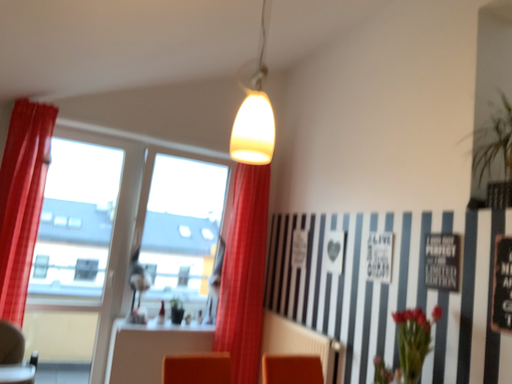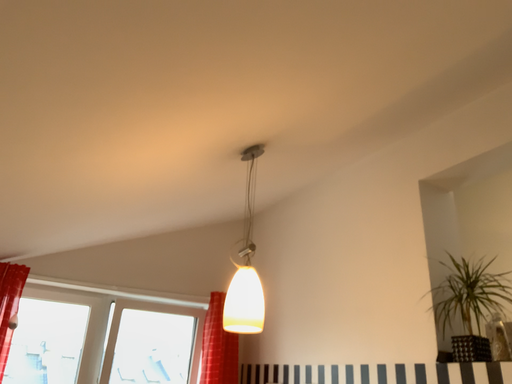
Question: Which way did the camera rotate in the video?

Choices:
 (A) rotated left
 (B) rotated right

Answer: (B)